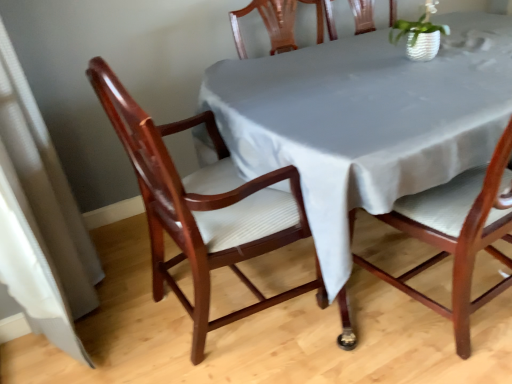
Question: From the image's perspective, is mahogany wood chair at center, which is the 1th chair in right-to-left order, beneath white textured pot at upper right?

Choices:
 (A) no
 (B) yes

Answer: (B)

Question: Considering the relative positions of mahogany wood chair at center, the second chair when ordered from left to right, and white textured pot at upper right in the image provided, is mahogany wood chair at center, the second chair when ordered from left to right, in front of white textured pot at upper right?

Choices:
 (A) no
 (B) yes

Answer: (B)

Question: Is mahogany wood chair at center, the second chair when ordered from left to right, not inside white textured pot at upper right?

Choices:
 (A) yes
 (B) no

Answer: (A)

Question: Does mahogany wood chair at center, the second chair when ordered from left to right, touch white textured pot at upper right?

Choices:
 (A) yes
 (B) no

Answer: (B)

Question: Could you tell me if mahogany wood chair at center, which is the 1th chair in right-to-left order, is turned towards white textured pot at upper right?

Choices:
 (A) yes
 (B) no

Answer: (A)

Question: In terms of height, does smooth gray tablecloth at center look taller or shorter compared to mahogany wood chair at left, placed as the second chair when sorted from right to left?

Choices:
 (A) tall
 (B) short

Answer: (B)

Question: Is smooth gray tablecloth at center to the left or to the right of mahogany wood chair at left, which is the 1th chair from left to right, in the image?

Choices:
 (A) left
 (B) right

Answer: (B)

Question: In terms of width, does smooth gray tablecloth at center look wider or thinner when compared to mahogany wood chair at left, which is the 1th chair from left to right?

Choices:
 (A) thin
 (B) wide

Answer: (B)

Question: From the image's perspective, is smooth gray tablecloth at center positioned above or below mahogany wood chair at left, which is the 1th chair from left to right?

Choices:
 (A) below
 (B) above

Answer: (B)

Question: Is mahogany wood chair at left, placed as the second chair when sorted from right to left, situated inside smooth gray tablecloth at center or outside?

Choices:
 (A) inside
 (B) outside

Answer: (A)

Question: Relative to smooth gray tablecloth at center, is mahogany wood chair at left, which is the 1th chair from left to right, in front or behind?

Choices:
 (A) front
 (B) behind

Answer: (A)

Question: In terms of width, does mahogany wood chair at left, placed as the second chair when sorted from right to left, look wider or thinner when compared to smooth gray tablecloth at center?

Choices:
 (A) wide
 (B) thin

Answer: (B)

Question: From a real-world perspective, is mahogany wood chair at left, which is the 1th chair from left to right, positioned above or below smooth gray tablecloth at center?

Choices:
 (A) below
 (B) above

Answer: (B)

Question: Is point (467, 352) positioned closer to the camera than point (425, 13)?

Choices:
 (A) closer
 (B) farther

Answer: (A)

Question: Considering the positions of mahogany wood chair at center, the second chair when ordered from left to right, and white textured pot at upper right in the image, is mahogany wood chair at center, the second chair when ordered from left to right, wider or thinner than white textured pot at upper right?

Choices:
 (A) thin
 (B) wide

Answer: (B)